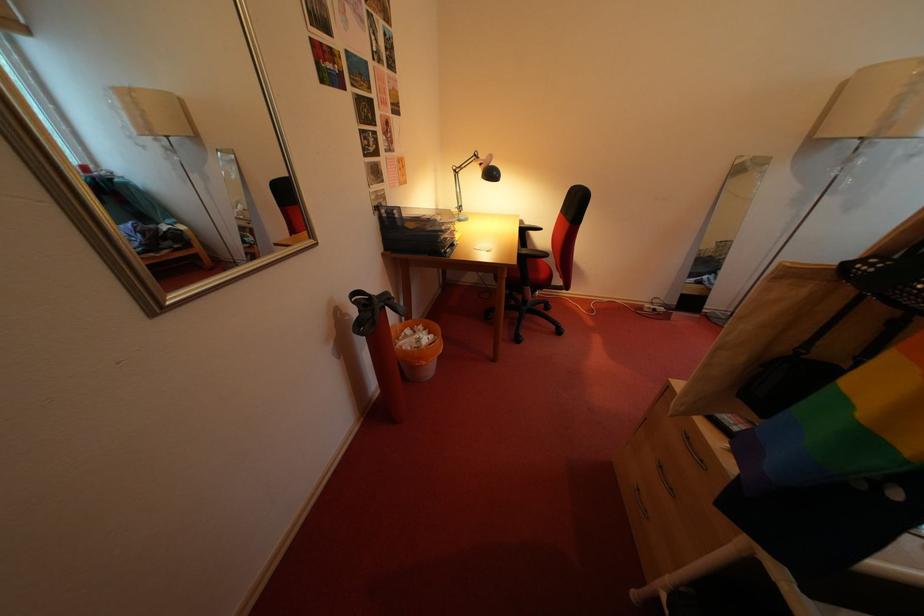
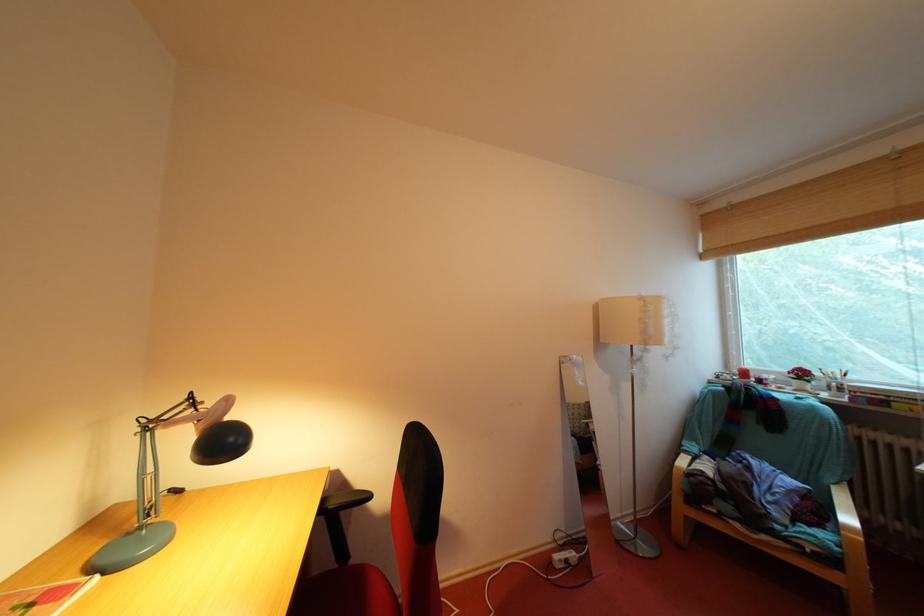
The point at (493,171) is marked in the first image. Where is the corresponding point in the second image?

(215, 429)